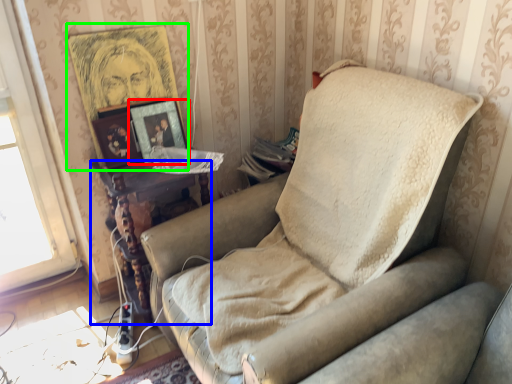
Question: Which object is positioned closest to picture frame (highlighted by a red box)? Select from table (highlighted by a blue box) and picture frame (highlighted by a green box).

Choices:
 (A) table
 (B) picture frame

Answer: (B)